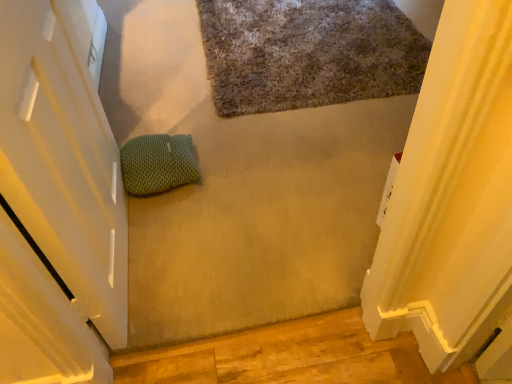
Identify the location of vacant area that lies to the right of green mesh pillow at center. (223, 168).